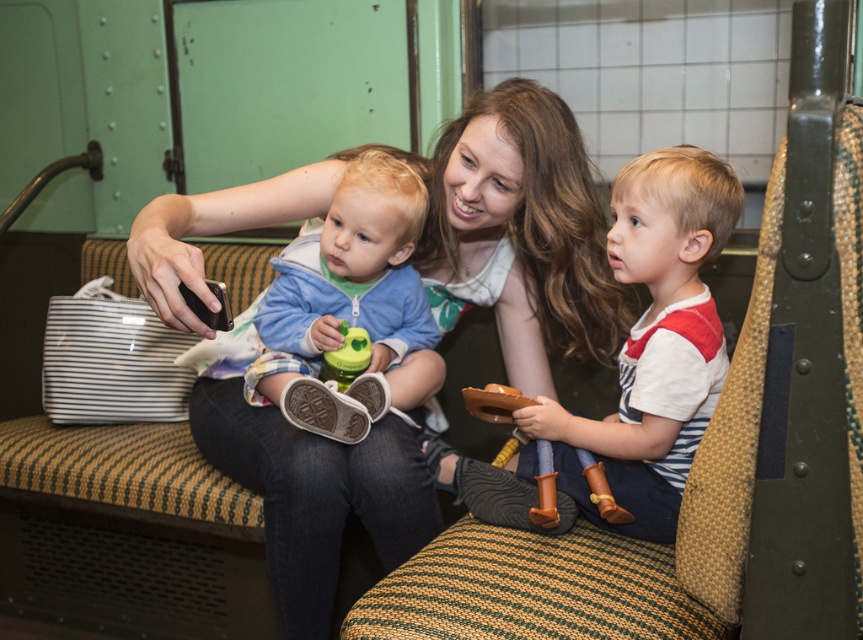
Question: Is matte green shirt at center behind light blue fleece jacket at center?

Choices:
 (A) no
 (B) yes

Answer: (A)

Question: Is matte green shirt at center closer to the viewer compared to light blue fleece jacket at center?

Choices:
 (A) yes
 (B) no

Answer: (A)

Question: From the image, what is the correct spatial relationship of matte green shirt at center in relation to striped cotton shirt at center?

Choices:
 (A) above
 (B) below

Answer: (A)

Question: Considering the real-world distances, which object is closest to the striped cotton shirt at center?

Choices:
 (A) light blue fleece jacket at center
 (B) matte green shirt at center

Answer: (B)

Question: Which object appears farthest from the camera in this image?

Choices:
 (A) matte green shirt at center
 (B) striped cotton shirt at center

Answer: (B)

Question: Based on their relative distances, which object is farther from the light blue fleece jacket at center?

Choices:
 (A) striped cotton shirt at center
 (B) matte green shirt at center

Answer: (A)